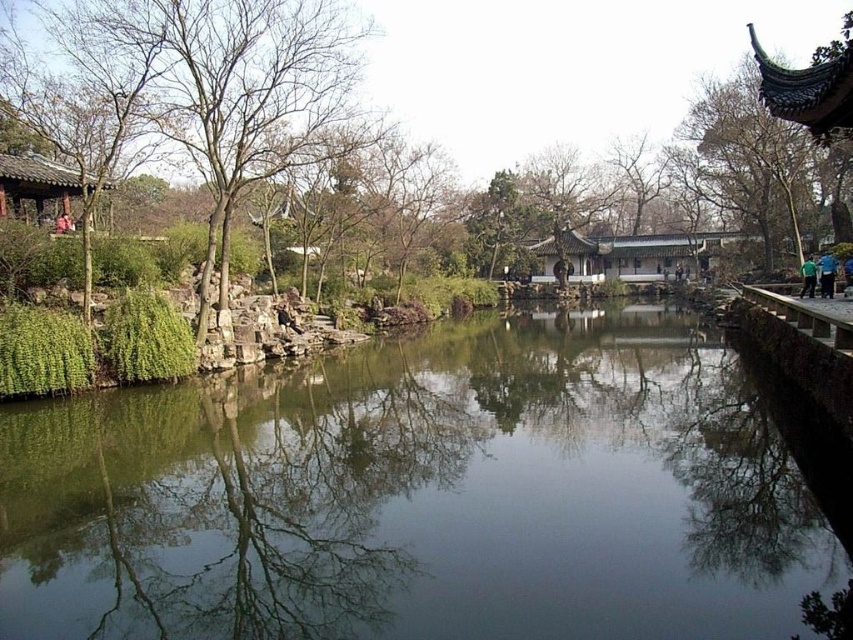
You are a visitor in the garden and want to cross the green stone river at center. There is a stepping stone path leading to the green leafy tree at left. Can you reach the tree by stepping on the stones without getting wet?

The green stone river at center has a smaller size compared to green leafy tree at left, so the river is narrower than the tree. Since the stepping stones are placed across the river, you can safely cross using the stones and reach the green leafy tree at left without getting wet.

You are standing at the center of the traditional Chinese garden scene. There is a green stone river at center. Can you confirm if the green stone river at center is located exactly at the point with coordinates (x=424, y=496)?

Yes, the green stone river at center is located exactly at the point with coordinates (x=424, y=496).

You are a painter standing in the traditional Chinese garden. You want to paint the green stone river at center and the green leafy tree at left. Which object should you focus on first if you want to paint the narrower one first?

The green stone river at center is thinner than the green leafy tree at left, so you should focus on painting the green stone river at center first.